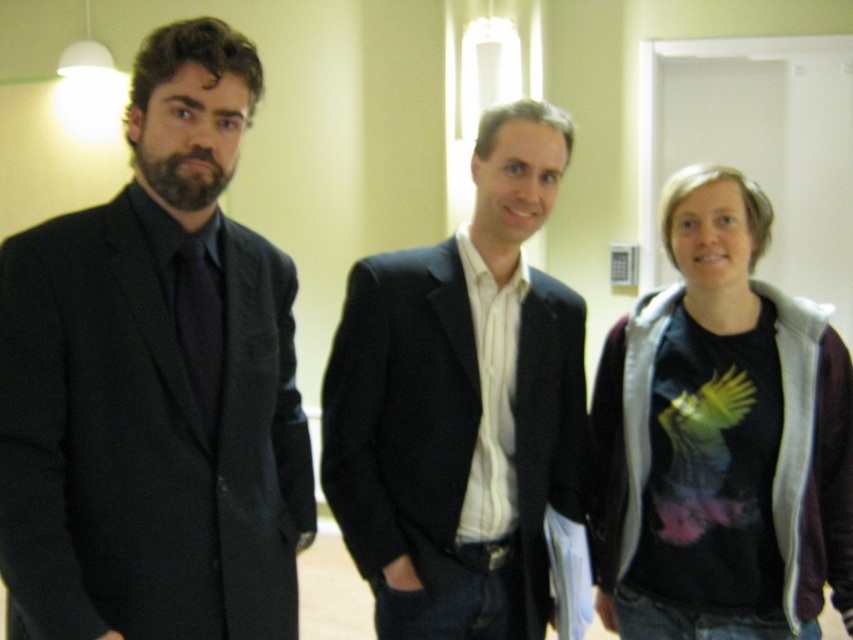
Question: Estimate the real-world distances between objects in this image. Which object is closer to the matte black suit at left?

Choices:
 (A) black t-shirt at right
 (B) black matte suit at center

Answer: (B)

Question: Is black matte suit at center smaller than black t-shirt at right?

Choices:
 (A) no
 (B) yes

Answer: (B)

Question: Which of the following is the farthest from the observer?

Choices:
 (A) (744, 330)
 (B) (85, 266)

Answer: (A)

Question: Is matte black suit at left to the left of black matte suit at center from the viewer's perspective?

Choices:
 (A) no
 (B) yes

Answer: (B)

Question: Which point is closer to the camera?

Choices:
 (A) matte black suit at left
 (B) black matte suit at center

Answer: (A)

Question: Does matte black suit at left lie behind black matte suit at center?

Choices:
 (A) yes
 (B) no

Answer: (B)